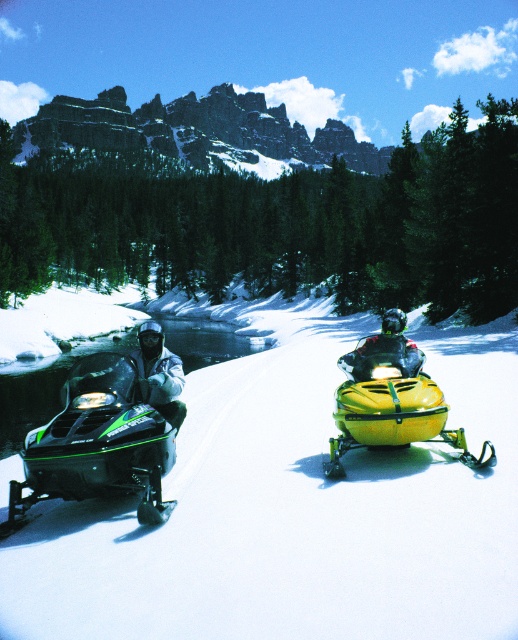
Is yellow matte snowmobile at center closer to the viewer compared to white matte jacket at left?

Yes, it is.

What do you see at coordinates (391, 403) in the screenshot? The height and width of the screenshot is (640, 518). I see `yellow matte snowmobile at center` at bounding box center [391, 403].

Find the location of `yellow matte snowmobile at center`. yellow matte snowmobile at center is located at coordinates (391, 403).

Is yellow matte snowmobile at center thinner than yellow plastic snowmobile at center?

Incorrect, yellow matte snowmobile at center's width is not less than yellow plastic snowmobile at center's.

Looking at this image, is yellow matte snowmobile at center above yellow plastic snowmobile at center?

No, yellow matte snowmobile at center is not above yellow plastic snowmobile at center.

Where is `yellow matte snowmobile at center`? The height and width of the screenshot is (640, 518). yellow matte snowmobile at center is located at coordinates (391, 403).

Locate an element on the screen. This screenshot has height=640, width=518. yellow matte snowmobile at center is located at coordinates (391, 403).

Can you confirm if green matte snowmobile at left is bigger than yellow matte snowmobile at center?

Correct, green matte snowmobile at left is larger in size than yellow matte snowmobile at center.

Which of these two, green matte snowmobile at left or yellow matte snowmobile at center, stands taller?

Standing taller between the two is green matte snowmobile at left.

Where is `green matte snowmobile at left`? This screenshot has height=640, width=518. green matte snowmobile at left is located at coordinates (97, 444).